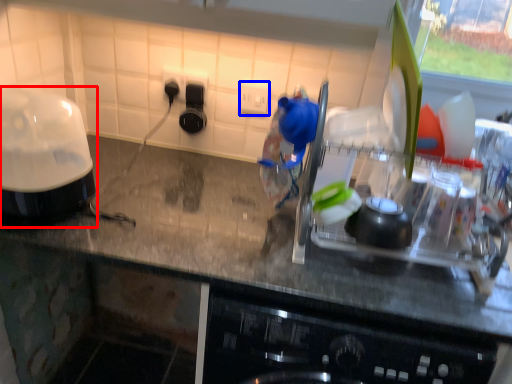
Question: Which object appears farthest to the camera in this image, home appliance (highlighted by a red box) or electric outlet (highlighted by a blue box)?

Choices:
 (A) home appliance
 (B) electric outlet

Answer: (B)